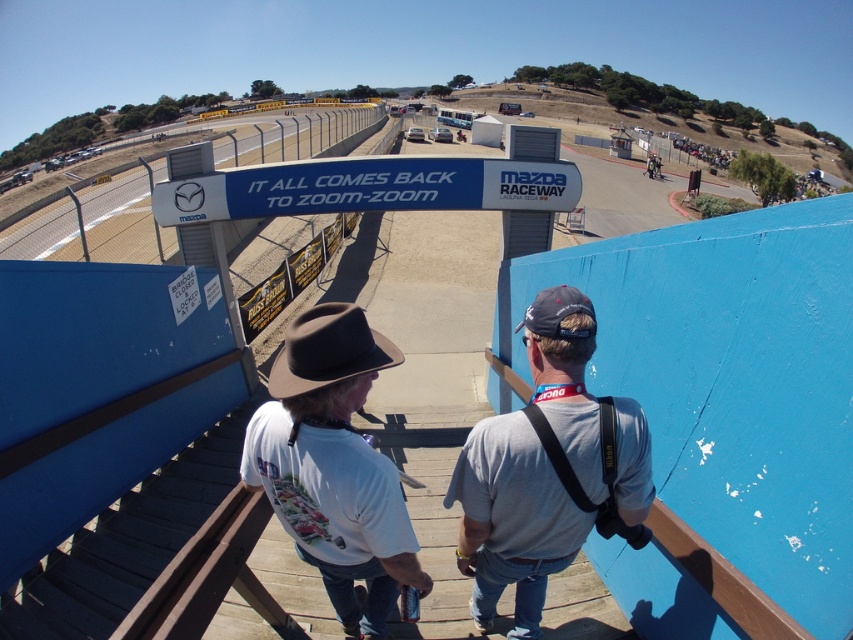
Question: Among these objects, which one is farthest from the camera?

Choices:
 (A) white cotton t-shirt at center
 (B) blue plastic sign at center

Answer: (B)

Question: Does white cotton t-shirt at center have a smaller size compared to blue plastic sign at center?

Choices:
 (A) no
 (B) yes

Answer: (B)

Question: Which object is farther from the camera taking this photo?

Choices:
 (A) gray fabric shirt at center
 (B) blue plastic sign at center

Answer: (B)

Question: Can you confirm if white cotton t-shirt at center is positioned below blue plastic sign at center?

Choices:
 (A) no
 (B) yes

Answer: (B)

Question: Does gray fabric shirt at center have a larger size compared to blue plastic sign at center?

Choices:
 (A) yes
 (B) no

Answer: (B)

Question: Which object appears farthest from the camera in this image?

Choices:
 (A) blue plastic sign at center
 (B) white cotton t-shirt at center
 (C) gray fabric shirt at center

Answer: (A)